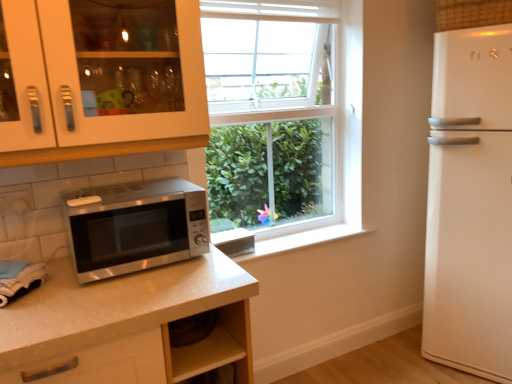
Question: Considering the relative positions of white glossy cabinet at upper left and satin silver microwave at lower left in the image provided, is white glossy cabinet at upper left behind satin silver microwave at lower left?

Choices:
 (A) yes
 (B) no

Answer: (B)

Question: Is white glossy cabinet at upper left facing away from satin silver microwave at lower left?

Choices:
 (A) yes
 (B) no

Answer: (B)

Question: From the image's perspective, is white glossy cabinet at upper left on satin silver microwave at lower left?

Choices:
 (A) no
 (B) yes

Answer: (B)

Question: Considering the relative sizes of white glossy cabinet at upper left and satin silver microwave at lower left in the image provided, is white glossy cabinet at upper left bigger than satin silver microwave at lower left?

Choices:
 (A) no
 (B) yes

Answer: (B)

Question: Considering the relative positions of white glossy cabinet at upper left and satin silver microwave at lower left in the image provided, is white glossy cabinet at upper left in front of satin silver microwave at lower left?

Choices:
 (A) no
 (B) yes

Answer: (B)

Question: From a real-world perspective, is white glossy cabinet at upper left below satin silver microwave at lower left?

Choices:
 (A) no
 (B) yes

Answer: (A)

Question: From the image's perspective, is satin silver microwave at lower left above white glossy cabinet at upper left?

Choices:
 (A) no
 (B) yes

Answer: (A)

Question: Is satin silver microwave at lower left at the right side of white glossy cabinet at upper left?

Choices:
 (A) no
 (B) yes

Answer: (B)

Question: Is satin silver microwave at lower left smaller than white glossy cabinet at upper left?

Choices:
 (A) no
 (B) yes

Answer: (B)

Question: Can you confirm if satin silver microwave at lower left is shorter than white glossy cabinet at upper left?

Choices:
 (A) no
 (B) yes

Answer: (B)

Question: From a real-world perspective, does satin silver microwave at lower left stand above white glossy cabinet at upper left?

Choices:
 (A) no
 (B) yes

Answer: (A)

Question: Would you say white glossy cabinet at upper left is part of satin silver microwave at lower left's contents?

Choices:
 (A) yes
 (B) no

Answer: (B)

Question: Does white glossy refrigerator at right come behind satin silver microwave at lower left?

Choices:
 (A) no
 (B) yes

Answer: (B)